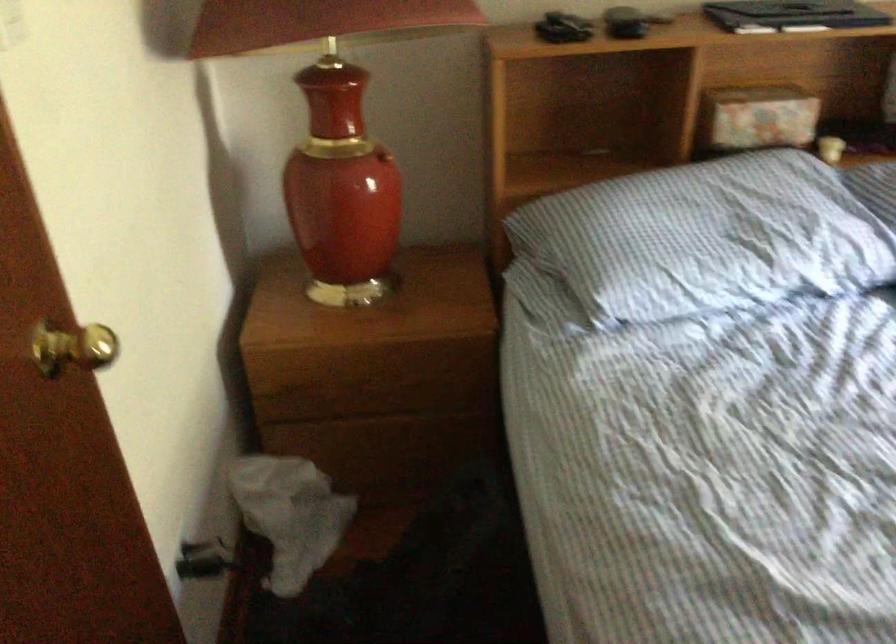
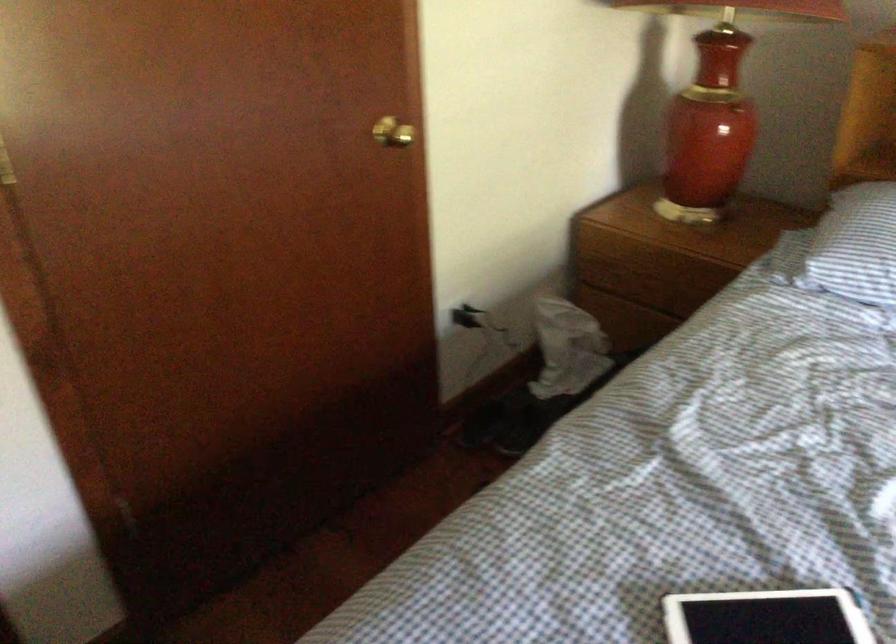
In the second image, find the point that corresponds to the point at 192,561 in the first image.

(470, 317)